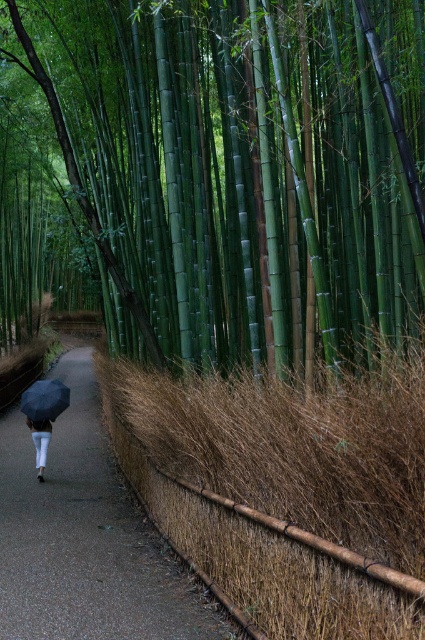
Question: Considering the real-world distances, which object is closest to the white matte pants at lower left?

Choices:
 (A) green bamboo forest at center
 (B) brown woven mat at center
 (C) matte black umbrella at lower left

Answer: (C)

Question: Which point is closer to the camera?

Choices:
 (A) white matte pants at lower left
 (B) green bamboo forest at center

Answer: (B)

Question: Is green bamboo forest at center to the left of white matte pants at lower left from the viewer's perspective?

Choices:
 (A) yes
 (B) no

Answer: (B)

Question: From the image, what is the correct spatial relationship of green bamboo forest at center in relation to matte black umbrella at lower left?

Choices:
 (A) above
 (B) below

Answer: (A)

Question: Can you confirm if matte black umbrella at lower left is wider than white matte pants at lower left?

Choices:
 (A) no
 (B) yes

Answer: (B)

Question: Which point is farther from the camera taking this photo?

Choices:
 (A) (37, 436)
 (B) (3, 536)
 (C) (207, 188)

Answer: (A)